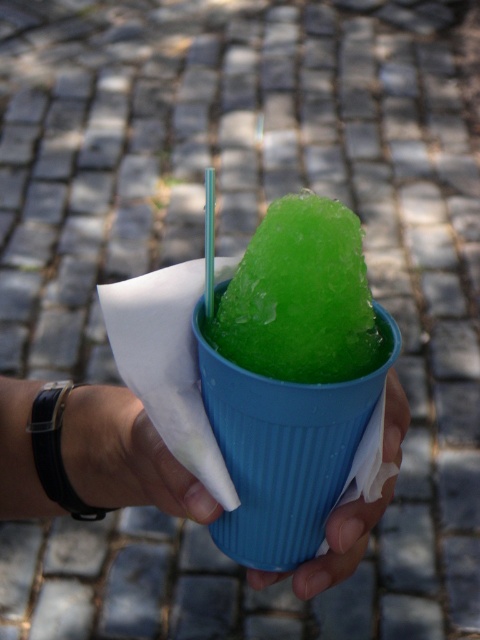
From the picture: Does green frosted ice at center have a lesser width compared to blue plastic cup at center?

Yes.

Between green frosted ice at center and blue plastic cup at center, which one appears on the left side from the viewer's perspective?

Positioned to the left is green frosted ice at center.

The image size is (480, 640). Find the location of `green frosted ice at center`. green frosted ice at center is located at coordinates (300, 298).

Who is lower down, green frosted ice at center or smooth skin hand at center?

smooth skin hand at center is lower down.

Does green frosted ice at center have a lesser width compared to smooth skin hand at center?

Yes.

In order to click on green frosted ice at center in this screenshot , I will do `click(300, 298)`.

Find the location of a particular element. green frosted ice at center is located at coordinates (300, 298).

Is smooth skin hand at center bigger than blue plastic cup at center?

Yes, smooth skin hand at center is bigger than blue plastic cup at center.

What do you see at coordinates (126, 456) in the screenshot?
I see `smooth skin hand at center` at bounding box center [126, 456].

Find the location of `smooth skin hand at center`. smooth skin hand at center is located at coordinates point(126,456).